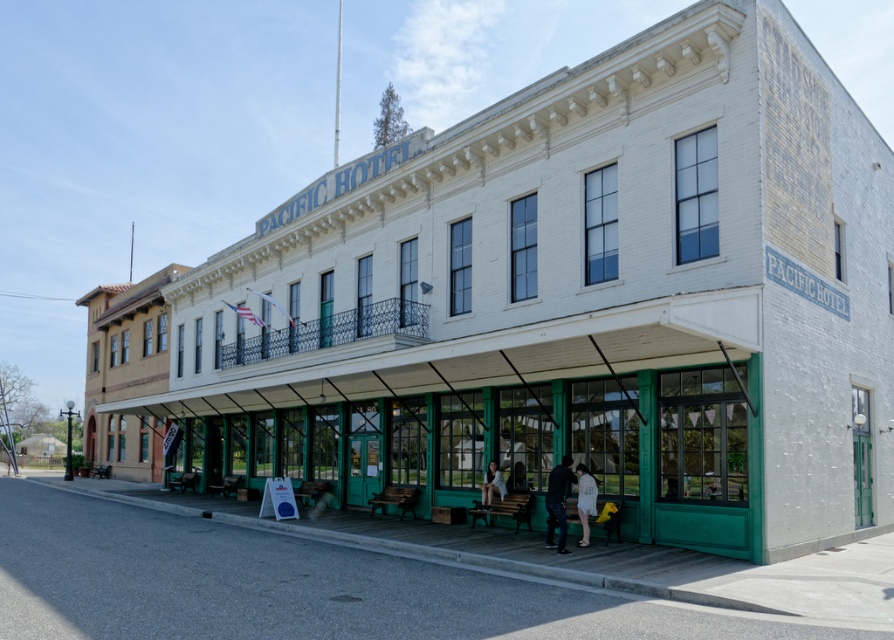
Question: Can you confirm if white cotton dress at lower center is positioned to the right of light brown wooden bench at lower center?

Choices:
 (A) yes
 (B) no

Answer: (A)

Question: Among these points, which one is nearest to the camera?

Choices:
 (A) (558, 525)
 (B) (500, 493)

Answer: (A)

Question: In this image, where is dark blue jeans at lower center located relative to white cotton dress at lower center?

Choices:
 (A) above
 (B) below

Answer: (A)

Question: Among these points, which one is nearest to the camera?

Choices:
 (A) (482, 493)
 (B) (584, 504)

Answer: (B)

Question: Considering the real-world distances, which object is farthest from the light brown wooden bench at lower center?

Choices:
 (A) white cotton dress at lower center
 (B) dark blue jeans at lower center

Answer: (B)

Question: Does white cotton dress at lower center appear over light brown wooden bench at lower center?

Choices:
 (A) yes
 (B) no

Answer: (A)